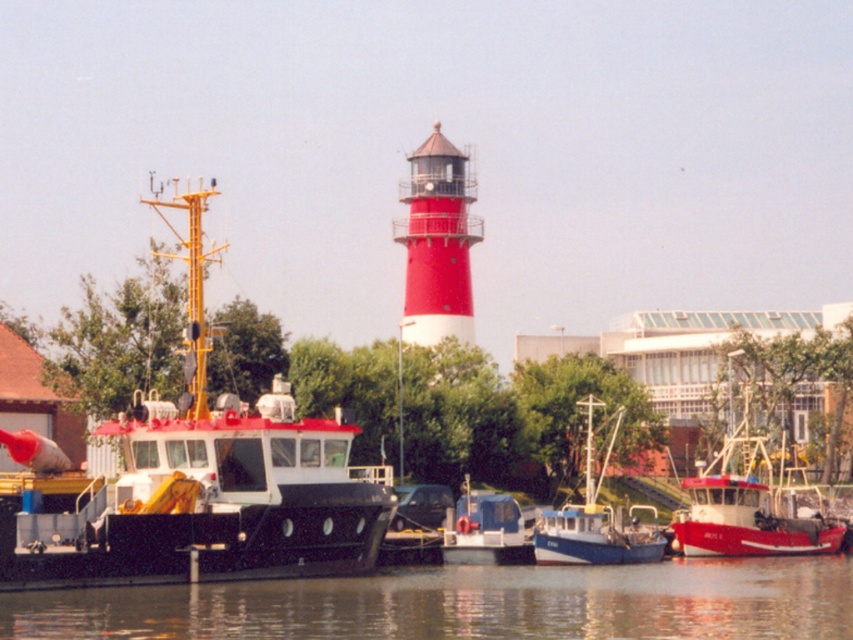
Question: Estimate the real-world distances between objects in this image. Which object is farther from the red painted metal lighthouse at center?

Choices:
 (A) blue plastic boat at center
 (B) blue matte boat at center
 (C) red matte boat at center
 (D) matte black boat at left

Answer: (D)

Question: Is the position of matte black boat at left more distant than that of red matte boat at center?

Choices:
 (A) no
 (B) yes

Answer: (A)

Question: Which point is closer to the camera taking this photo?

Choices:
 (A) (778, 532)
 (B) (7, 452)
 (C) (595, 492)

Answer: (B)

Question: Is transparent water at lower center to the left of red painted metal lighthouse at center from the viewer's perspective?

Choices:
 (A) no
 (B) yes

Answer: (A)

Question: Which point appears farthest from the camera in this image?

Choices:
 (A) (285, 588)
 (B) (415, 192)
 (C) (451, 557)
 (D) (740, 394)

Answer: (B)

Question: Is matte black boat at left positioned behind red painted metal lighthouse at center?

Choices:
 (A) no
 (B) yes

Answer: (A)